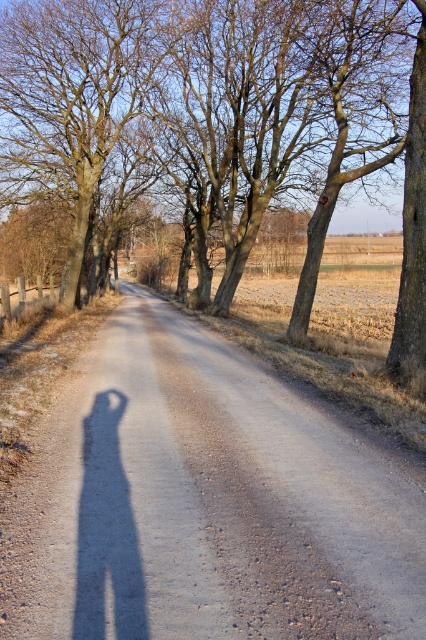
From the picture: Is dirt road at center taller than brown bark tree at center?

Incorrect, dirt road at center's height is not larger of brown bark tree at center's.

Who is taller, dirt road at center or brown bark tree at center?

brown bark tree at center

Where is `dirt road at center`? dirt road at center is located at coordinates (207, 500).

What are the coordinates of `dirt road at center` in the screenshot? It's located at (207, 500).

Is brown bark tree at center further to the viewer compared to brown rough tree at upper left?

No, it is not.

Find the location of a particular element. This screenshot has height=640, width=426. brown bark tree at center is located at coordinates (224, 112).

Is point (411, 164) closer to camera compared to point (97, 147)?

Yes.

In order to click on brown bark tree at center in this screenshot , I will do `click(224, 112)`.

Can you confirm if dirt road at center is wider than brown rough tree at upper left?

No.

What do you see at coordinates (207, 500) in the screenshot? Image resolution: width=426 pixels, height=640 pixels. I see `dirt road at center` at bounding box center [207, 500].

This screenshot has width=426, height=640. Describe the element at coordinates (207, 500) in the screenshot. I see `dirt road at center` at that location.

Find the location of a particular element. This screenshot has width=426, height=640. dirt road at center is located at coordinates (207, 500).